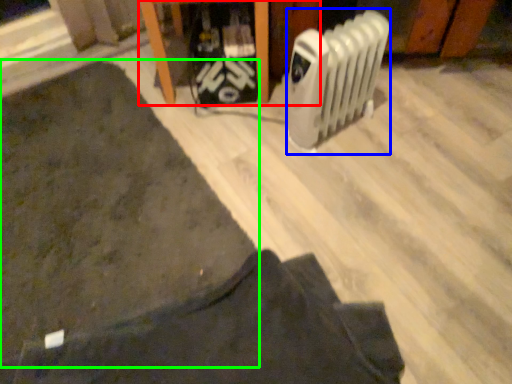
Question: Estimate the real-world distances between objects in this image. Which object is closer to furniture (highlighted by a red box), radiator (highlighted by a blue box) or mat (highlighted by a green box)?

Choices:
 (A) radiator
 (B) mat

Answer: (A)